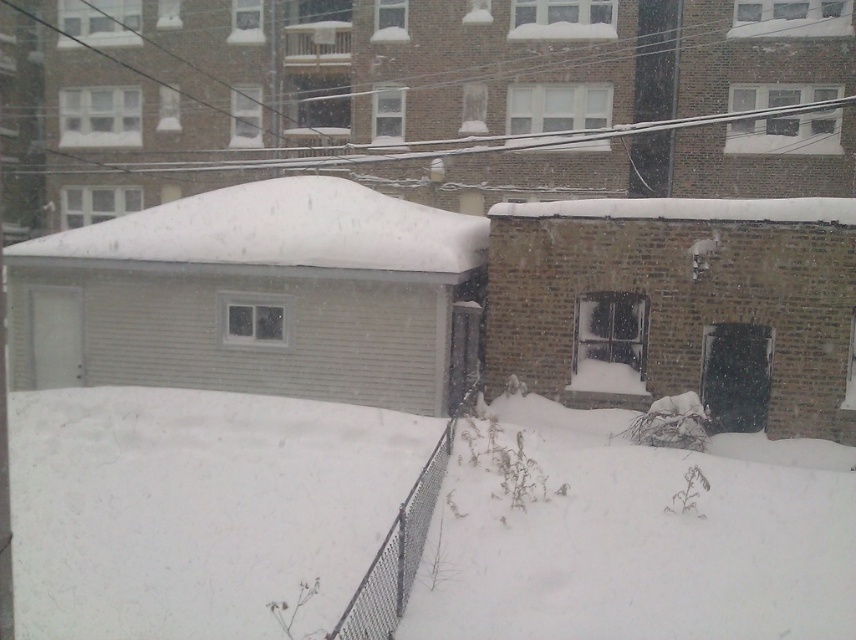
Question: Which object is farther from the camera taking this photo?

Choices:
 (A) white fluffy snow at lower left
 (B) white fluffy snow at center

Answer: (B)

Question: Is white fluffy snow at lower left positioned before white fluffy snow at center?

Choices:
 (A) no
 (B) yes

Answer: (B)

Question: Can you confirm if white fluffy snow at lower left is positioned to the right of white fluffy snow at center?

Choices:
 (A) no
 (B) yes

Answer: (B)

Question: In this image, where is white fluffy snow at lower left located relative to white fluffy snow at center?

Choices:
 (A) above
 (B) below

Answer: (B)

Question: Which point is closer to the camera?

Choices:
 (A) white fluffy snow at center
 (B) white fluffy snow at lower left

Answer: (B)

Question: Among these points, which one is nearest to the camera?

Choices:
 (A) (163, 448)
 (B) (462, 237)

Answer: (A)